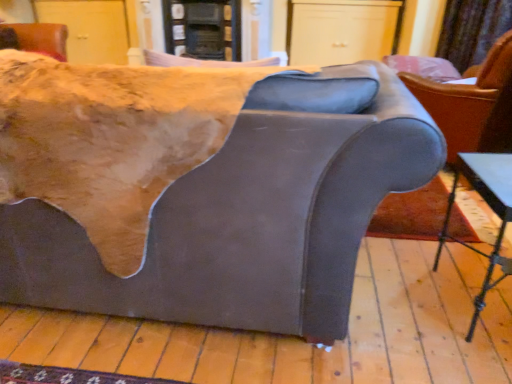
Image resolution: width=512 pixels, height=384 pixels. What do you see at coordinates (490, 207) in the screenshot?
I see `metallic silver table at lower right` at bounding box center [490, 207].

What do you see at coordinates (244, 224) in the screenshot? I see `suede-like gray couch at center` at bounding box center [244, 224].

Identify the location of matte gray armchair at right. (465, 99).

From the image's perspective, is metallic silver table at lower right above or below velvet curtain at upper right?

Based on their image positions, metallic silver table at lower right is located beneath velvet curtain at upper right.

Would you say metallic silver table at lower right is a long distance from velvet curtain at upper right?

metallic silver table at lower right is far away from velvet curtain at upper right.

This screenshot has width=512, height=384. Find the location of `table in front of the velvet curtain at upper right`. table in front of the velvet curtain at upper right is located at coordinates (490, 207).

From a real-world perspective, who is located higher, metallic silver table at lower right or velvet curtain at upper right?

velvet curtain at upper right.

Consider the image. Considering the relative positions of suede-like gray couch at center and matte gray armchair at right in the image provided, is suede-like gray couch at center to the left or to the right of matte gray armchair at right?

Based on their positions, suede-like gray couch at center is located to the left of matte gray armchair at right.

Is the position of suede-like gray couch at center more distant than that of matte gray armchair at right?

No, it is not.

Based on the photo, from the image's perspective, is suede-like gray couch at center on top of matte gray armchair at right?

No, from the image's perspective, suede-like gray couch at center is not above matte gray armchair at right.

Could you tell me if suede-like gray couch at center is turned towards matte gray armchair at right?

No, suede-like gray couch at center is not aimed at matte gray armchair at right.

From a real-world perspective, which is physically below, suede-like gray couch at center or velvet curtain at upper right?

suede-like gray couch at center is physically lower.

Which object is closer to the camera, suede-like gray couch at center or velvet curtain at upper right?

Positioned in front is suede-like gray couch at center.

From the image's perspective, is suede-like gray couch at center located beneath velvet curtain at upper right?

Yes, from the image's perspective, suede-like gray couch at center is beneath velvet curtain at upper right.

Is matte gray armchair at right to the left of suede-like gray couch at center from the viewer's perspective?

No, matte gray armchair at right is not to the left of suede-like gray couch at center.

From a real-world perspective, is matte gray armchair at right physically located above or below suede-like gray couch at center?

In terms of real-world spatial position, matte gray armchair at right is above suede-like gray couch at center.

Considering their positions, is matte gray armchair at right located in front of or behind suede-like gray couch at center?

In the image, matte gray armchair at right appears behind suede-like gray couch at center.

Considering the relative sizes of suede-like gray couch at center and metallic silver table at lower right in the image provided, is suede-like gray couch at center bigger than metallic silver table at lower right?

Yes.

Is suede-like gray couch at center not within metallic silver table at lower right?

Absolutely, suede-like gray couch at center is external to metallic silver table at lower right.

From a real-world perspective, which object stands above the other?

From a 3D spatial view, suede-like gray couch at center is above.

Between matte gray armchair at right and metallic silver table at lower right, which one is positioned in front?

metallic silver table at lower right is closer to the camera.

Does matte gray armchair at right have a greater height compared to metallic silver table at lower right?

Yes, matte gray armchair at right is taller than metallic silver table at lower right.

Is matte gray armchair at right directly adjacent to metallic silver table at lower right?

matte gray armchair at right and metallic silver table at lower right are not in contact.

Which object is positioned more to the right, velvet curtain at upper right or matte gray armchair at right?

Positioned to the right is velvet curtain at upper right.

From the picture: Is velvet curtain at upper right wider or thinner than matte gray armchair at right?

Considering their sizes, velvet curtain at upper right looks slimmer than matte gray armchair at right.

Consider the image. From a real-world perspective, is velvet curtain at upper right located higher than matte gray armchair at right?

Indeed, from a real-world perspective, velvet curtain at upper right stands above matte gray armchair at right.

Could you tell me if velvet curtain at upper right is facing matte gray armchair at right?

Yes, velvet curtain at upper right is facing matte gray armchair at right.

Find the location of a particular element. Image resolution: width=512 pixels, height=384 pixels. curtain on the right side of metallic silver table at lower right is located at coordinates (472, 30).

You are a GUI agent. You are given a task and a screenshot of the screen. Output one action in this format:
    pyautogui.click(x=<x>, y=<y>)
    Task: Click on the studio couch below the matte gray armchair at right (from the image's perspective)
    
    Given the screenshot: What is the action you would take?
    pyautogui.click(x=244, y=224)

Looking at the image, which one is located further to metallic silver table at lower right, matte gray armchair at right or suede-like gray couch at center?

The object further to metallic silver table at lower right is suede-like gray couch at center.

Considering their positions, is metallic silver table at lower right positioned closer to velvet curtain at upper right than matte gray armchair at right?

The object closer to velvet curtain at upper right is matte gray armchair at right.

Estimate the real-world distances between objects in this image. Which object is further from suede-like gray couch at center, matte gray armchair at right or velvet curtain at upper right?

Based on the image, velvet curtain at upper right appears to be further to suede-like gray couch at center.

Looking at the image, which one is located further to suede-like gray couch at center, metallic silver table at lower right or matte gray armchair at right?

Among the two, matte gray armchair at right is located further to suede-like gray couch at center.

From the picture: Based on their spatial positions, is matte gray armchair at right or suede-like gray couch at center closer to velvet curtain at upper right?

matte gray armchair at right is positioned closer to the anchor velvet curtain at upper right.

Looking at the image, which one is located further to suede-like gray couch at center, velvet curtain at upper right or metallic silver table at lower right?

velvet curtain at upper right is further to suede-like gray couch at center.

Looking at the image, which one is located further to matte gray armchair at right, metallic silver table at lower right or velvet curtain at upper right?

Based on the image, velvet curtain at upper right appears to be further to matte gray armchair at right.

From the image, which object appears to be nearer to matte gray armchair at right, suede-like gray couch at center or velvet curtain at upper right?

suede-like gray couch at center.

Identify the location of chair positioned between suede-like gray couch at center and velvet curtain at upper right from near to far. click(465, 99).

Where is `table between suede-like gray couch at center and matte gray armchair at right in the horizontal direction`? Image resolution: width=512 pixels, height=384 pixels. table between suede-like gray couch at center and matte gray armchair at right in the horizontal direction is located at coordinates (490, 207).

You are a GUI agent. You are given a task and a screenshot of the screen. Output one action in this format:
    pyautogui.click(x=<x>, y=<y>)
    Task: Click on the chair between metallic silver table at lower right and velvet curtain at upper right along the z-axis
    
    Given the screenshot: What is the action you would take?
    pyautogui.click(x=465, y=99)

Locate an element on the screen. This screenshot has width=512, height=384. table positioned between suede-like gray couch at center and velvet curtain at upper right from near to far is located at coordinates (490, 207).